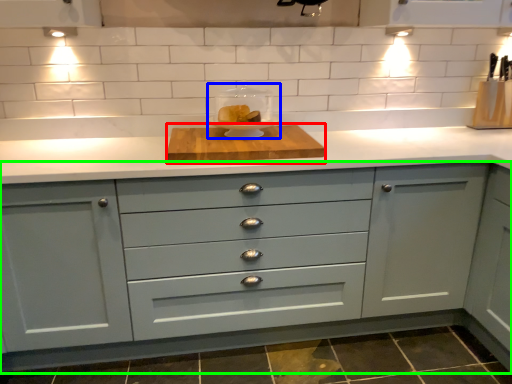
Question: Estimate the real-world distances between objects in this image. Which object is farther from cutting board (highlighted by a red box), appliance (highlighted by a blue box) or cabinetry (highlighted by a green box)?

Choices:
 (A) appliance
 (B) cabinetry

Answer: (B)